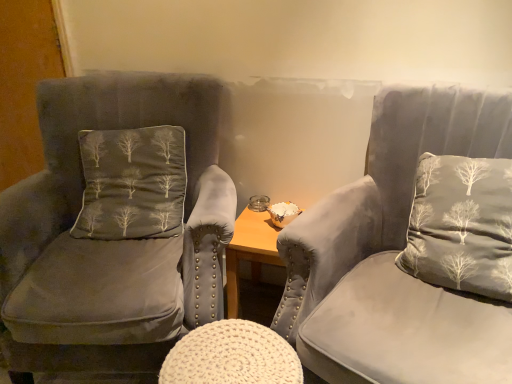
In order to click on free space above white knitted stool at center (from a real-world perspective) in this screenshot , I will do `click(226, 352)`.